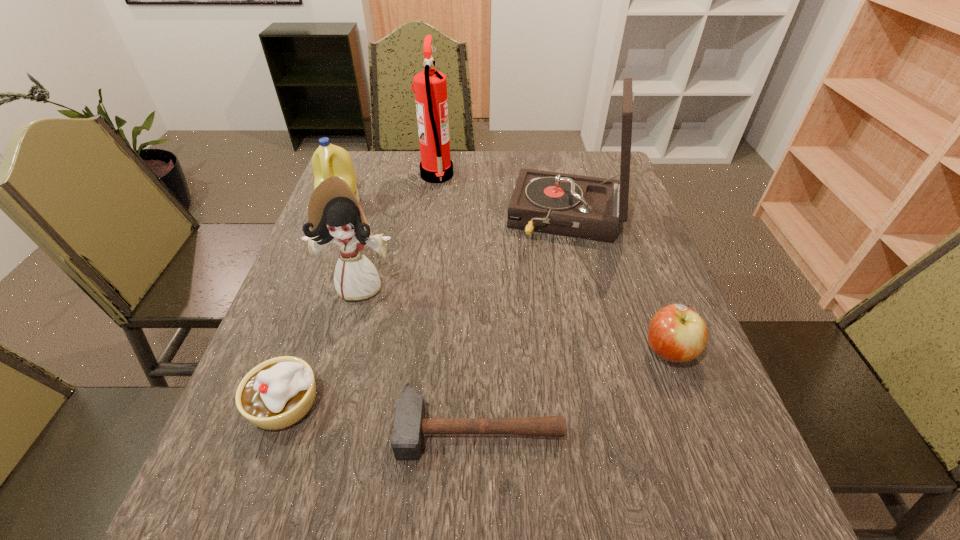
Locate an element on the screen. This screenshot has width=960, height=540. unoccupied position between the phonograph record and the fourth farthest object is located at coordinates (464, 251).

Identify the location of free space between the fifth shortest object and the phonograph record. (464, 251).

This screenshot has height=540, width=960. What are the coordinates of `free space between the fifth shortest object and the hammer` in the screenshot? It's located at (420, 356).

This screenshot has height=540, width=960. What are the coordinates of `vacant space that's between the fire extinguisher and the apple` in the screenshot? It's located at (553, 264).

The height and width of the screenshot is (540, 960). Find the location of `free area in between the shortest object and the fire extinguisher`. free area in between the shortest object and the fire extinguisher is located at coordinates (458, 302).

Identify the location of vacant space in between the phonograph record and the whipped cream. The width and height of the screenshot is (960, 540). tap(426, 310).

Where is `free point between the phonograph record and the fourth tallest object`? The height and width of the screenshot is (540, 960). free point between the phonograph record and the fourth tallest object is located at coordinates (454, 212).

Identify which object is located as the third nearest to the whipped cream. Please provide its 2D coordinates. Your answer should be formatted as a tuple, i.e. [(x, y)], where the tuple contains the x and y coordinates of a point satisfying the conditions above.

[(328, 160)]

Find the location of `object that stands as the closest to the shortest object`. object that stands as the closest to the shortest object is located at coordinates (277, 393).

Identify the location of free point that satisfies the following two spatial constraints: 1. with the nozzle aimed from the fire extinguisher; 2. on the left side of the phonograph record. (431, 218).